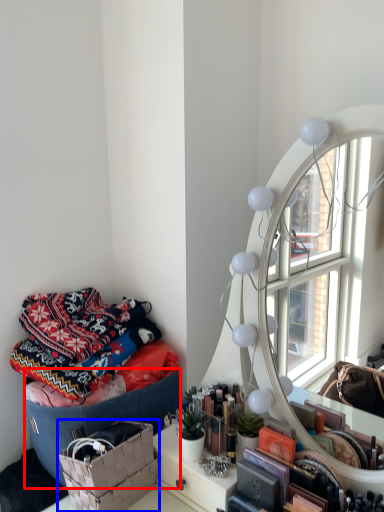
Question: Which of the following is the farthest to the observer, storage box (highlighted by a red box) or basket (highlighted by a blue box)?

Choices:
 (A) storage box
 (B) basket

Answer: (A)